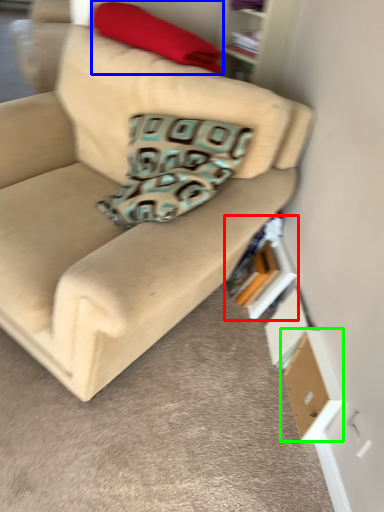
Question: Which object is the farthest from book (highlighted by a red box)? Choose among these: blanket (highlighted by a blue box) or cardboard box (highlighted by a green box).

Choices:
 (A) blanket
 (B) cardboard box

Answer: (A)